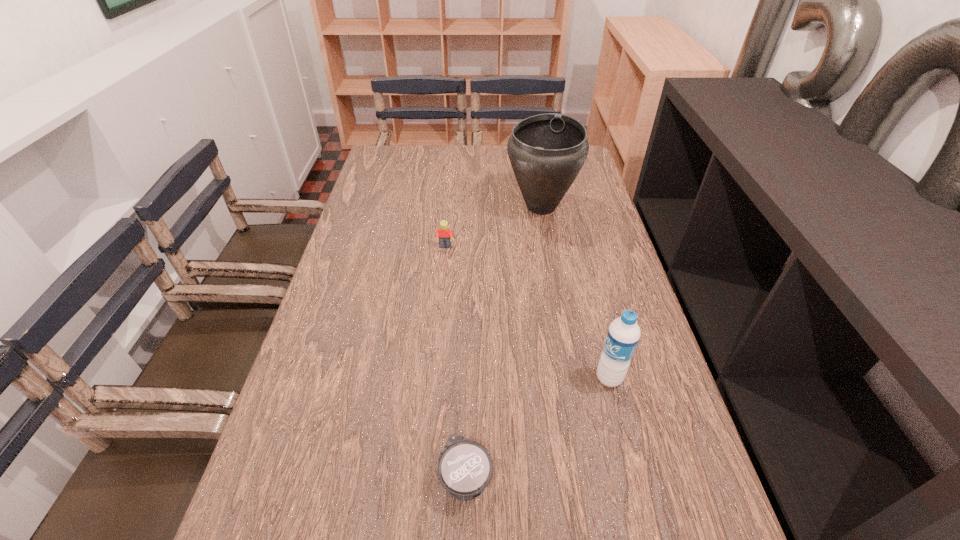
Image resolution: width=960 pixels, height=540 pixels. In order to click on the closest object to the second shortest object in this screenshot , I will do `click(547, 151)`.

You are a GUI agent. You are given a task and a screenshot of the screen. Output one action in this format:
    pyautogui.click(x=<x>, y=<y>)
    Task: Click on the free space in the image that satisfies the following two spatial constraints: 1. on the label of the third shortest object; 2. on the front side of the nearest object
    This screenshot has width=960, height=540.
    Given the screenshot: What is the action you would take?
    click(634, 477)